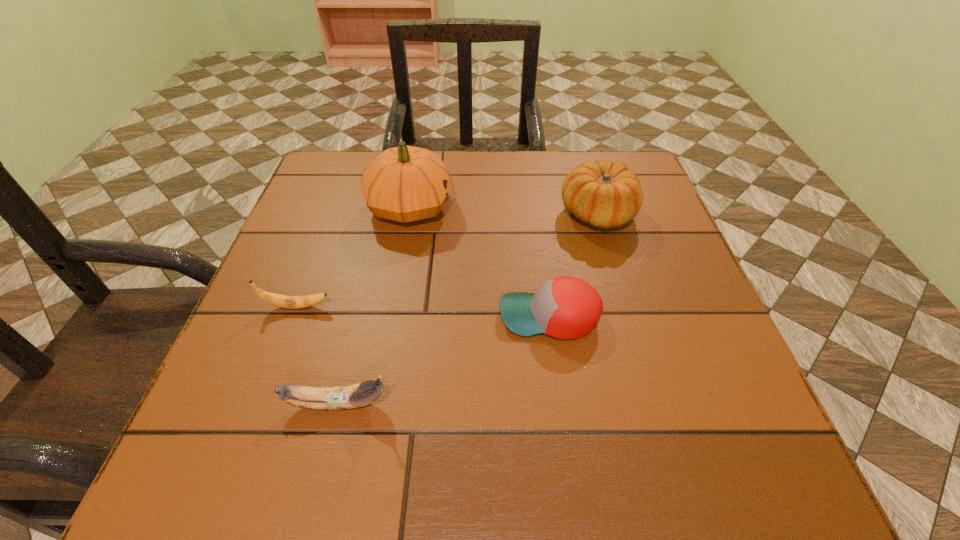
Locate an element on the screen. The height and width of the screenshot is (540, 960). vacant position at the near edge of the desktop is located at coordinates (656, 460).

You are a GUI agent. You are given a task and a screenshot of the screen. Output one action in this format:
    pyautogui.click(x=<x>, y=<y>)
    Task: Click on the vacant space at the left edge of the desktop
    
    Given the screenshot: What is the action you would take?
    pyautogui.click(x=322, y=325)

In the image, there is a desktop. Identify the location of vacant space at the right edge. This screenshot has width=960, height=540. (685, 345).

Find the location of a particular element. Image resolution: width=960 pixels, height=540 pixels. vacant space at the far left corner of the desktop is located at coordinates (320, 162).

In the image, there is a desktop. Identify the location of vacant region at the near left corner. (225, 448).

The image size is (960, 540). I want to click on vacant space at the far right corner of the desktop, so click(615, 154).

Locate an element on the screen. This screenshot has width=960, height=540. vacant space at the near right corner is located at coordinates (773, 471).

Where is `vacant area that lies between the shorter banana and the shorter gourd`? This screenshot has height=540, width=960. vacant area that lies between the shorter banana and the shorter gourd is located at coordinates (447, 260).

Where is `vacant area that lies between the farther banana and the nearest object`? The width and height of the screenshot is (960, 540). vacant area that lies between the farther banana and the nearest object is located at coordinates (317, 355).

This screenshot has width=960, height=540. Identify the location of unoccupied position between the farther banana and the taller banana. (317, 355).